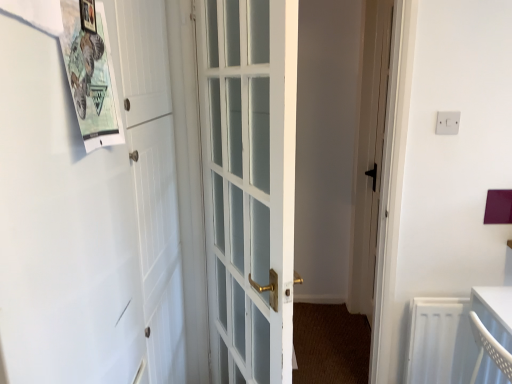
Image resolution: width=512 pixels, height=384 pixels. Identify the location of white plastic electric outlet at upper right. pos(447,123).

This screenshot has height=384, width=512. What are the coordinates of `white plastic electric outlet at upper right` in the screenshot? It's located at (447, 123).

From a real-world perspective, is white matte barn door at left physically above white plastic electric outlet at upper right?

No, from a real-world perspective, white matte barn door at left is not over white plastic electric outlet at upper right

From the image's perspective, between white matte barn door at left and white plastic electric outlet at upper right, who is located below?

white matte barn door at left appears lower in the image.

Which is in front, white matte barn door at left or white plastic electric outlet at upper right?

white matte barn door at left.

Are white matte barn door at left and white plastic electric outlet at upper right located far from each other?

That's right, there is a large distance between white matte barn door at left and white plastic electric outlet at upper right.

Is white plastic electric outlet at upper right thinner than wooden picture frame at upper left?

Correct, the width of white plastic electric outlet at upper right is less than that of wooden picture frame at upper left.

Is point (442, 116) positioned behind point (82, 7)?

Yes, it is behind point (82, 7).

Is white plastic electric outlet at upper right directly adjacent to wooden picture frame at upper left?

They are not placed beside each other.

From the picture: How different are the orientations of wooden picture frame at upper left and paperboard poster at upper left in degrees?

They differ by 0.0135 degrees in their facing directions.

Could you tell me if wooden picture frame at upper left is turned towards paperboard poster at upper left?

Yes, wooden picture frame at upper left faces towards paperboard poster at upper left.

Is paperboard poster at upper left completely or partially inside wooden picture frame at upper left?

No, paperboard poster at upper left is located outside of wooden picture frame at upper left.

Between wooden picture frame at upper left and paperboard poster at upper left, which one has less height?

Standing shorter between the two is wooden picture frame at upper left.

From a real-world perspective, is paperboard poster at upper left above or below wooden picture frame at upper left?

paperboard poster at upper left is below wooden picture frame at upper left.

From the picture: Would you say paperboard poster at upper left is to the left or to the right of wooden picture frame at upper left in the picture?

Clearly, paperboard poster at upper left is on the right of wooden picture frame at upper left in the image.

Is paperboard poster at upper left wider or thinner than wooden picture frame at upper left?

paperboard poster at upper left is wider than wooden picture frame at upper left.

Is the position of paperboard poster at upper left less distant than that of wooden picture frame at upper left?

Yes.

Can you see wooden picture frame at upper left touching white glass door at center?

No, wooden picture frame at upper left is not making contact with white glass door at center.

Considering the sizes of wooden picture frame at upper left and white glass door at center in the image, is wooden picture frame at upper left bigger or smaller than white glass door at center?

Considering their sizes, wooden picture frame at upper left takes up less space than white glass door at center.

Between wooden picture frame at upper left and white glass door at center, which one has larger width?

white glass door at center is wider.

Is wooden picture frame at upper left outside of white glass door at center?

Yes.

Is paperboard poster at upper left bigger than white plastic electric outlet at upper right?

Indeed, paperboard poster at upper left has a larger size compared to white plastic electric outlet at upper right.

Could you measure the distance between paperboard poster at upper left and white plastic electric outlet at upper right?

paperboard poster at upper left is 4.27 feet from white plastic electric outlet at upper right.

In the scene shown: In the image, is paperboard poster at upper left on the left side or the right side of white plastic electric outlet at upper right?

paperboard poster at upper left is to the left of white plastic electric outlet at upper right.

Is paperboard poster at upper left next to white plastic electric outlet at upper right?

paperboard poster at upper left and white plastic electric outlet at upper right are not in contact.

Which of these two, white plastic electric outlet at upper right or white matte barn door at left, stands shorter?

Standing shorter between the two is white plastic electric outlet at upper right.

Which object is wider, white plastic electric outlet at upper right or white matte barn door at left?

white matte barn door at left.

Where is `barn door in front of the white plastic electric outlet at upper right`? This screenshot has height=384, width=512. barn door in front of the white plastic electric outlet at upper right is located at coordinates (61, 229).

Is white plastic electric outlet at upper right turned away from white matte barn door at left?

No, white plastic electric outlet at upper right is not facing the opposite direction of white matte barn door at left.

This screenshot has height=384, width=512. I want to click on barn door below the white plastic electric outlet at upper right (from the image's perspective), so click(x=61, y=229).

This screenshot has width=512, height=384. What are the coordinates of `picture frame located above the white plastic electric outlet at upper right (from a real-world perspective)` in the screenshot? It's located at (88, 16).

Considering their positions, is white matte barn door at left positioned further to white plastic electric outlet at upper right than wooden picture frame at upper left?

white matte barn door at left is further to white plastic electric outlet at upper right.

Looking at the image, which one is located closer to wooden picture frame at upper left, white matte barn door at left or paperboard poster at upper left?

paperboard poster at upper left is closer to wooden picture frame at upper left.

Considering their positions, is paperboard poster at upper left positioned closer to white glass door at center than white plastic electric outlet at upper right?

paperboard poster at upper left.

Based on their spatial positions, is white glass door at center or white plastic electric outlet at upper right closer to white matte barn door at left?

white glass door at center is positioned closer to the anchor white matte barn door at left.

Based on their spatial positions, is white plastic electric outlet at upper right or white matte barn door at left closer to wooden picture frame at upper left?

white matte barn door at left lies closer to wooden picture frame at upper left than the other object.

When comparing their distances from white matte barn door at left, does white plastic electric outlet at upper right or wooden picture frame at upper left seem further?

The object further to white matte barn door at left is white plastic electric outlet at upper right.

From the image, which object appears to be nearer to white matte barn door at left, white glass door at center or paperboard poster at upper left?

Among the two, paperboard poster at upper left is located nearer to white matte barn door at left.

Based on their spatial positions, is paperboard poster at upper left or wooden picture frame at upper left further from white plastic electric outlet at upper right?

wooden picture frame at upper left.

The height and width of the screenshot is (384, 512). I want to click on door located between wooden picture frame at upper left and white plastic electric outlet at upper right in the left-right direction, so click(x=249, y=184).

This screenshot has height=384, width=512. I want to click on door situated between paperboard poster at upper left and white plastic electric outlet at upper right from left to right, so click(x=249, y=184).

I want to click on bulletin board between wooden picture frame at upper left and white glass door at center vertically, so click(91, 77).

Where is `bulletin board between wooden picture frame at upper left and white plastic electric outlet at upper right in the horizontal direction`? The image size is (512, 384). bulletin board between wooden picture frame at upper left and white plastic electric outlet at upper right in the horizontal direction is located at coordinates (91, 77).